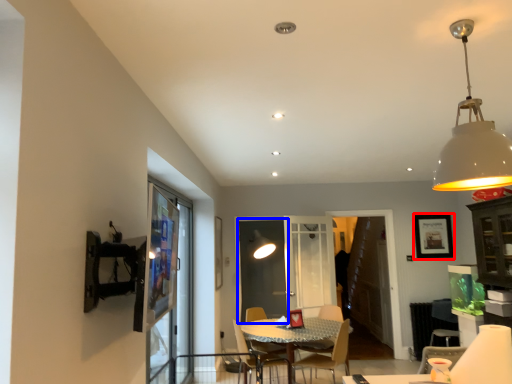
Question: Among these objects, which one is farthest to the camera, picture frame (highlighted by a red box) or screen door (highlighted by a blue box)?

Choices:
 (A) picture frame
 (B) screen door

Answer: (A)